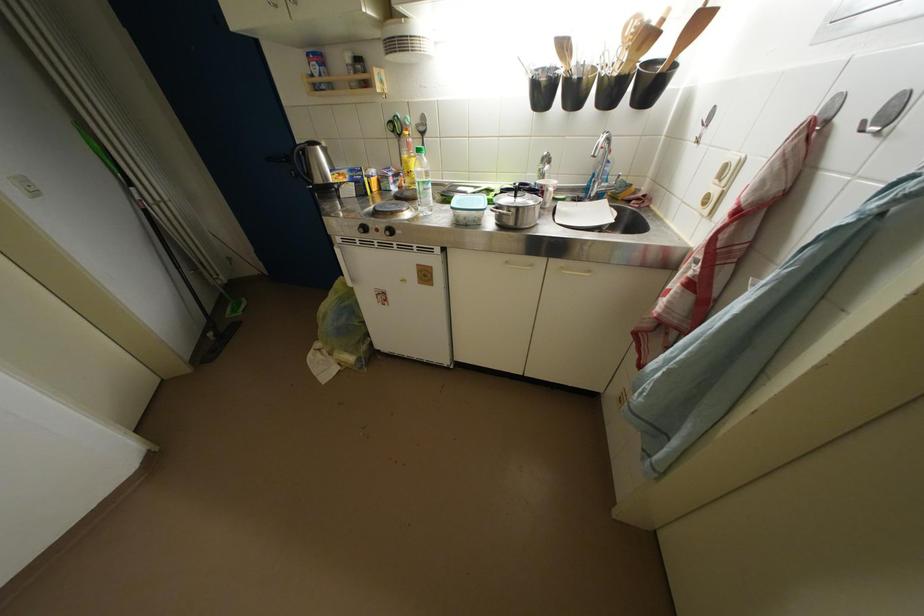
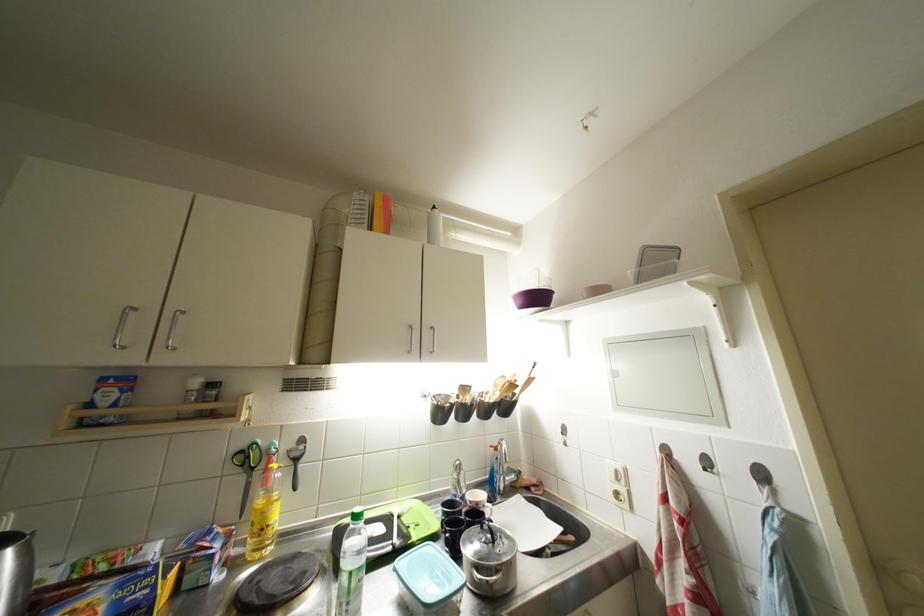
Find the pixel in the second image that matches the point at 397,121 in the first image.

(249, 450)